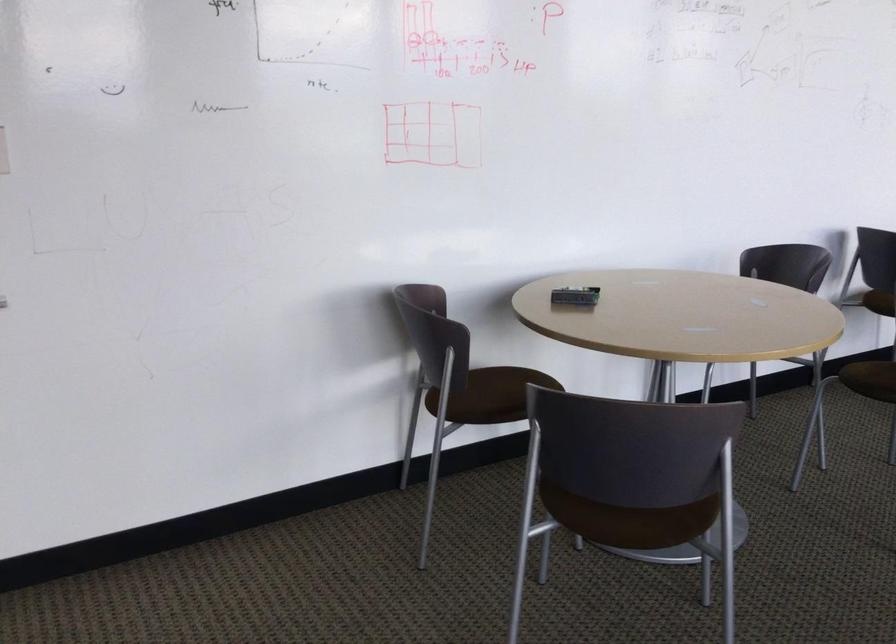
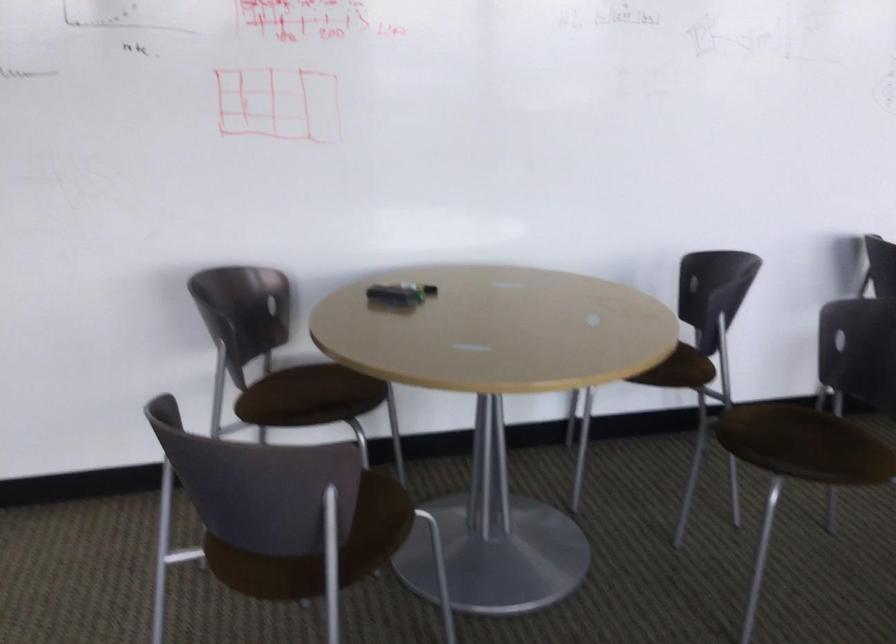
Question: The first image is from the beginning of the video and the second image is from the end. How did the camera likely rotate when shooting the video?

Choices:
 (A) Left
 (B) Right
 (C) Up
 (D) Down

Answer: (A)